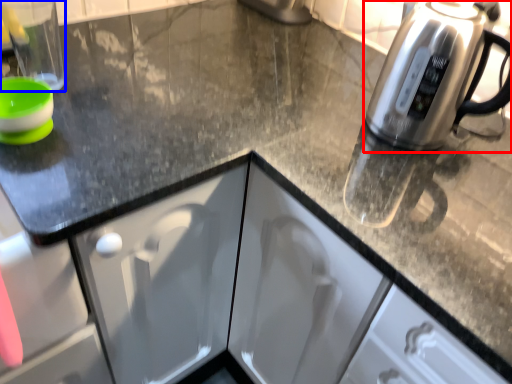
Question: Which object is further to the camera taking this photo, kettle (highlighted by a red box) or appliance (highlighted by a blue box)?

Choices:
 (A) kettle
 (B) appliance

Answer: (B)